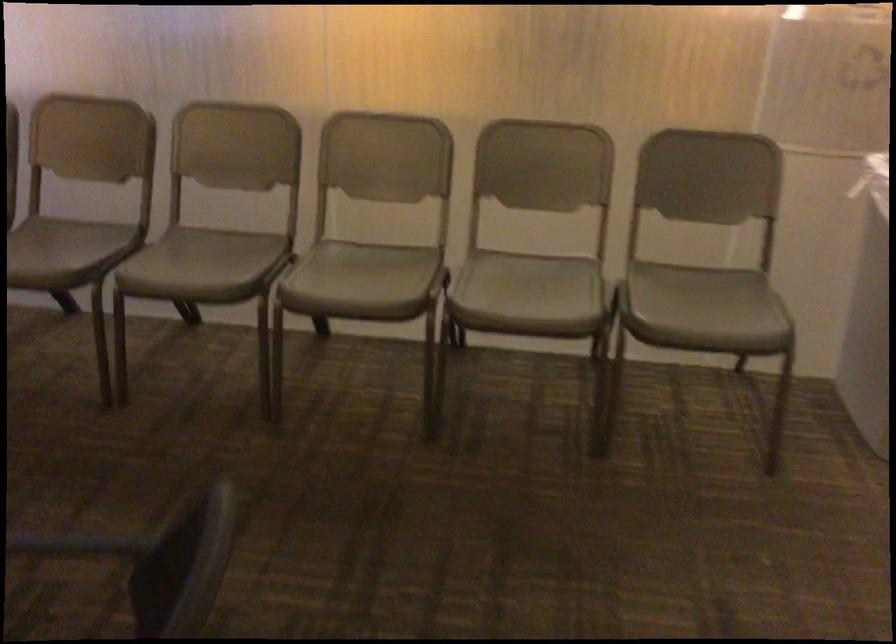
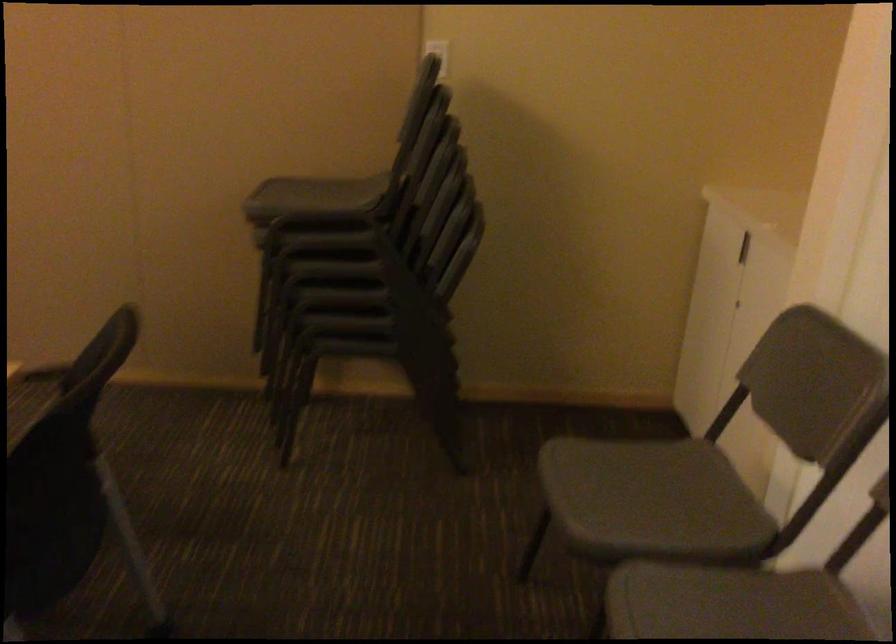
Question: What movement of the cameraman would produce the second image?

Choices:
 (A) Left
 (B) Right
 (C) Forward
 (D) Backward

Answer: (D)